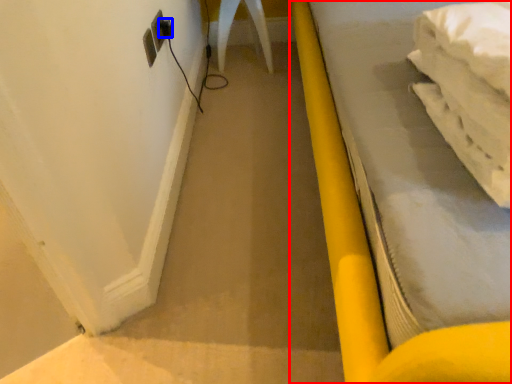
Question: Among these objects, which one is nearest to the camera, furniture (highlighted by a red box) or plug (highlighted by a blue box)?

Choices:
 (A) furniture
 (B) plug

Answer: (A)